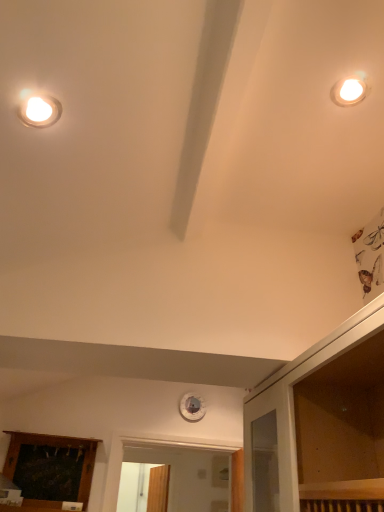
Question: Choose the correct answer: Is transparent glass dresser at upper right inside wooden panel at lower left or outside it?

Choices:
 (A) outside
 (B) inside

Answer: (A)

Question: Relative to wooden panel at lower left, is transparent glass dresser at upper right in front or behind?

Choices:
 (A) behind
 (B) front

Answer: (B)

Question: Is transparent glass dresser at upper right wider or thinner than wooden panel at lower left?

Choices:
 (A) wide
 (B) thin

Answer: (A)

Question: Visually, is wooden panel at lower left positioned to the left or to the right of transparent glass dresser at upper right?

Choices:
 (A) right
 (B) left

Answer: (B)

Question: In terms of height, does wooden panel at lower left look taller or shorter compared to transparent glass dresser at upper right?

Choices:
 (A) short
 (B) tall

Answer: (B)

Question: In terms of size, does wooden panel at lower left appear bigger or smaller than transparent glass dresser at upper right?

Choices:
 (A) small
 (B) big

Answer: (A)

Question: From a real-world perspective, is wooden panel at lower left above or below transparent glass dresser at upper right?

Choices:
 (A) above
 (B) below

Answer: (B)